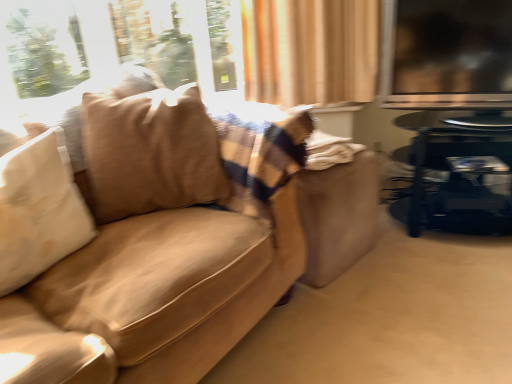
Question: Is shiny black table at right situated inside transparent glass window screen at upper right or outside?

Choices:
 (A) inside
 (B) outside

Answer: (B)

Question: Looking at the image, does shiny black table at right seem bigger or smaller compared to transparent glass window screen at upper right?

Choices:
 (A) small
 (B) big

Answer: (B)

Question: Which object is positioned closest to the transparent glass window screen at upper right?

Choices:
 (A) white soft pillow at left
 (B) shiny black table at right
 (C) brown textured pillow at left
 (D) suede-like beige couch at left

Answer: (B)

Question: Which object is positioned closest to the brown textured pillow at left?

Choices:
 (A) white soft pillow at left
 (B) shiny black table at right
 (C) suede-like beige couch at left
 (D) transparent glass window screen at upper right

Answer: (C)